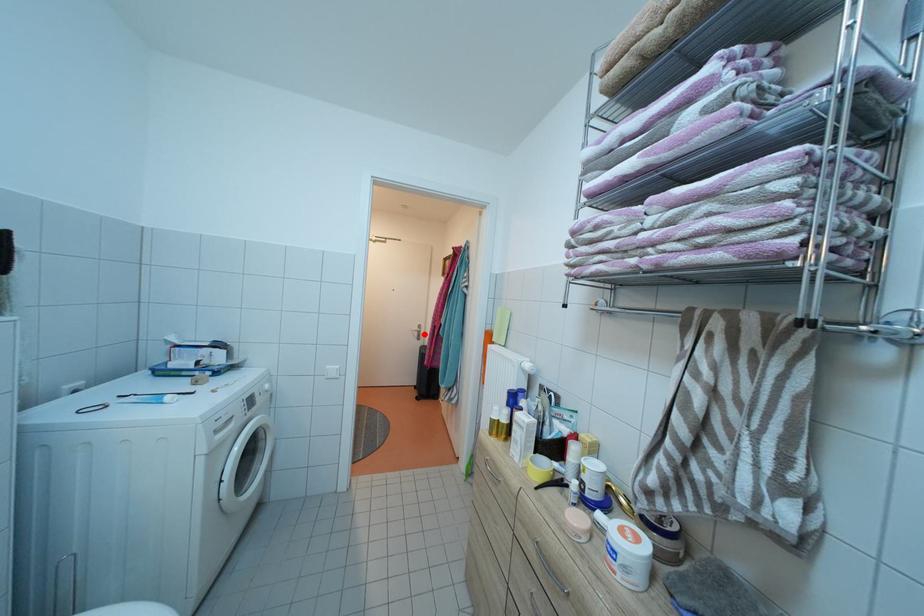
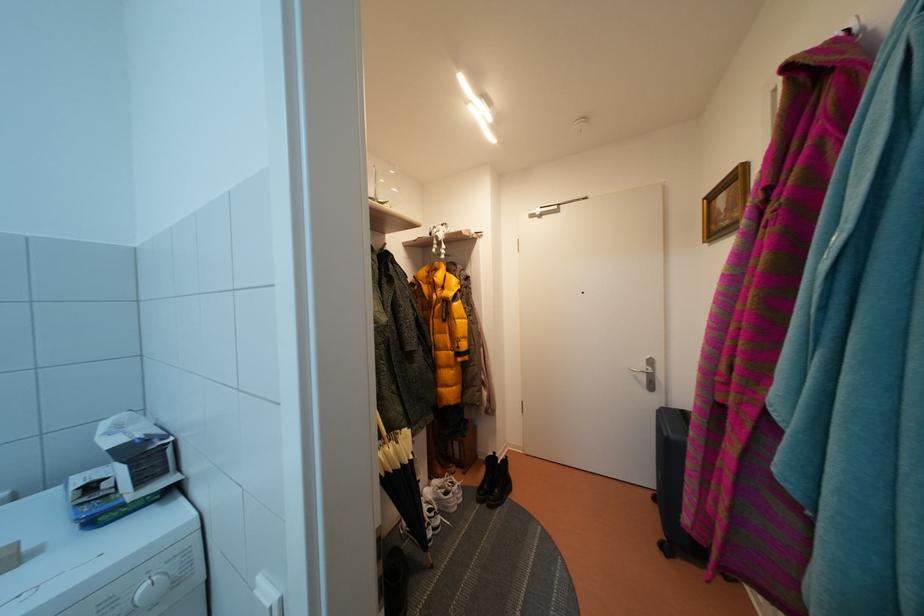
Question: A red point is marked in image1. In image2, is the corresponding 3D point closer to the camera or farther? Reply with the corresponding letter.

Choices:
 (A) The corresponding 3D point is closer.
 (B) The corresponding 3D point is farther.

Answer: (A)